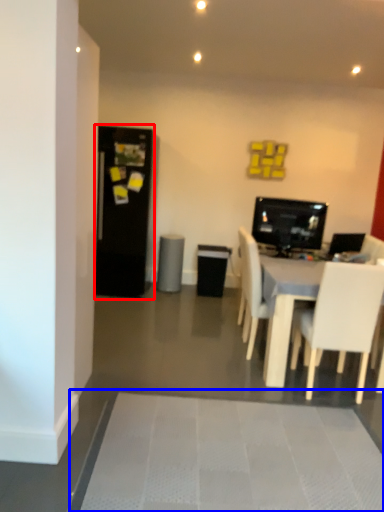
Question: Which object appears closest to the camera in this image, fridge (highlighted by a red box) or bath mat (highlighted by a blue box)?

Choices:
 (A) fridge
 (B) bath mat

Answer: (B)